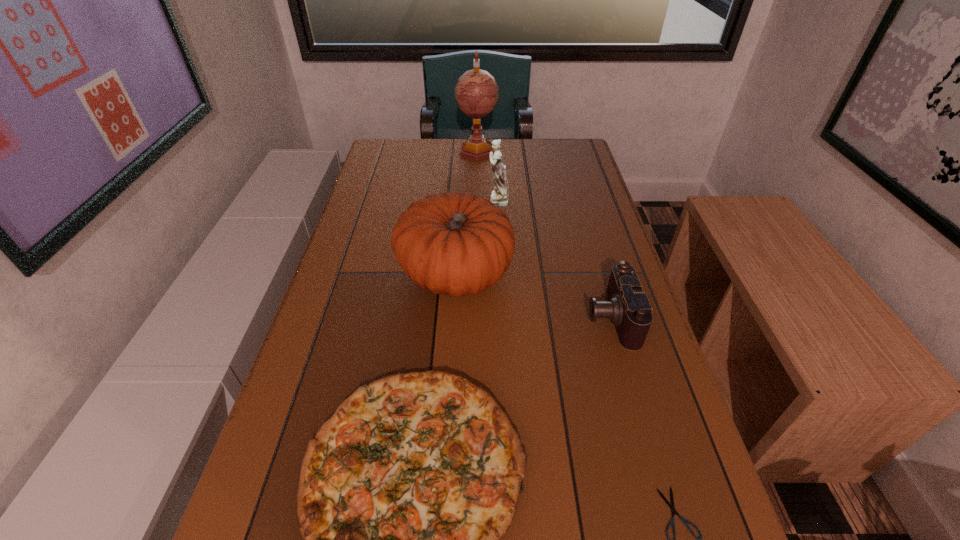
In order to click on the tallest object in this screenshot , I will do (476, 92).

Identify the location of the farthest object. Image resolution: width=960 pixels, height=540 pixels. click(476, 92).

Find the location of `the fifth nearest object`. the fifth nearest object is located at coordinates click(500, 196).

The height and width of the screenshot is (540, 960). Find the location of `pumpkin`. pumpkin is located at coordinates (450, 243).

Image resolution: width=960 pixels, height=540 pixels. What are the coordinates of `camera` in the screenshot? It's located at (629, 309).

I want to click on free point located 0.210m on the front-facing side of the farthest object, so [476, 197].

Where is `vacant region located on the front-facing side of the figurine`? vacant region located on the front-facing side of the figurine is located at coordinates (435, 200).

I want to click on free region located on the front-facing side of the figurine, so click(461, 200).

Image resolution: width=960 pixels, height=540 pixels. I want to click on free space located 0.220m on the front-facing side of the figurine, so click(x=412, y=200).

Where is `vacant space located 0.160m on the back of the pumpkin`? This screenshot has width=960, height=540. vacant space located 0.160m on the back of the pumpkin is located at coordinates (460, 206).